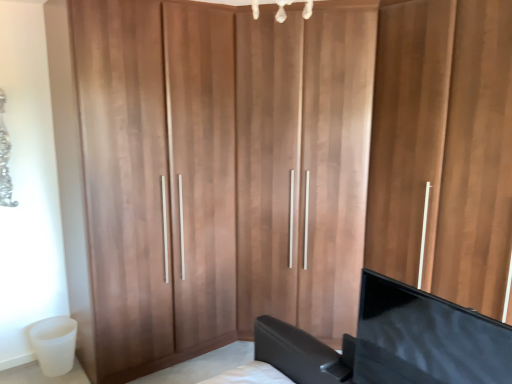
Identify the location of vacant point above black glossy tv at lower right (from a real-world perspective). The width and height of the screenshot is (512, 384). (433, 299).